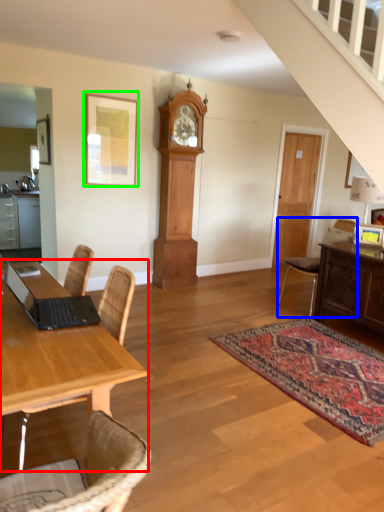
Question: Which object is the closest to the desk (highlighted by a red box)? Choose among these: chair (highlighted by a blue box) or picture frame (highlighted by a green box).

Choices:
 (A) chair
 (B) picture frame

Answer: (B)